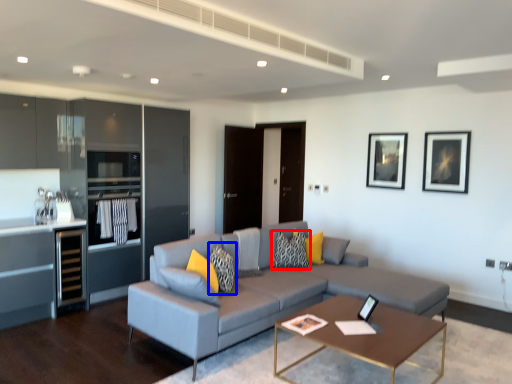
Question: Which object appears farthest to the camera in this image, pillow (highlighted by a red box) or pillow (highlighted by a blue box)?

Choices:
 (A) pillow
 (B) pillow

Answer: (A)